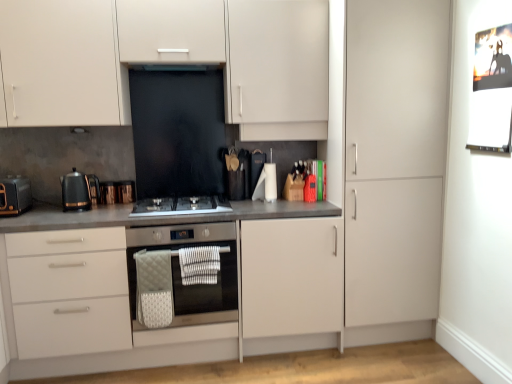
You are a GUI agent. You are given a task and a screenshot of the screen. Output one action in this format:
    pyautogui.click(x=<x>, y=<y>)
    Task: Click on the vacant space to the right of copper metallic toaster at left, the 2th appliance viewed from the right
    Image resolution: width=512 pixels, height=384 pixels.
    Given the screenshot: What is the action you would take?
    pyautogui.click(x=135, y=198)